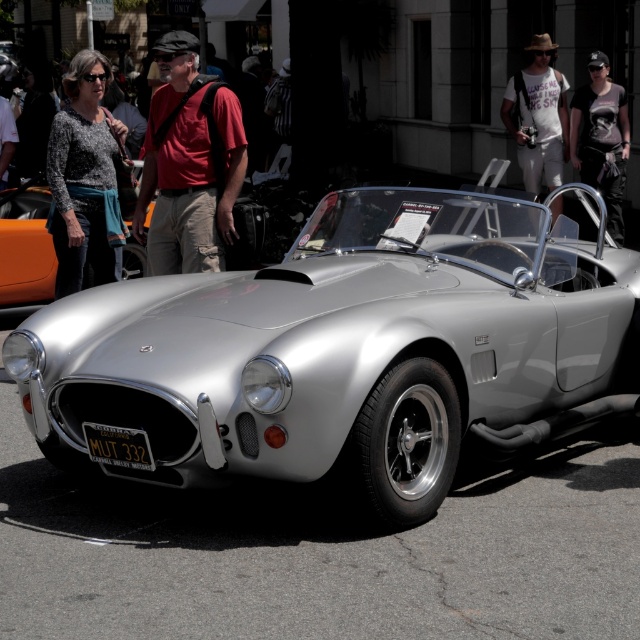
Who is lower down, dark gray cotton t-shirt at center or black metal license plate at center?

black metal license plate at center is below.

Can you confirm if dark gray cotton t-shirt at center is smaller than black metal license plate at center?

Actually, dark gray cotton t-shirt at center might be larger than black metal license plate at center.

Describe the element at coordinates (602, 138) in the screenshot. This screenshot has height=640, width=640. I see `dark gray cotton t-shirt at center` at that location.

What are the coordinates of `dark gray cotton t-shirt at center` in the screenshot? It's located at (602, 138).

How much distance is there between speckled sweater at upper left and dark gray cotton t-shirt at center?

A distance of 6.69 meters exists between speckled sweater at upper left and dark gray cotton t-shirt at center.

Between speckled sweater at upper left and dark gray cotton t-shirt at center, which one is positioned higher?

dark gray cotton t-shirt at center is above.

Does point (52, 132) come in front of point (592, 163)?

Yes.

Where is `speckled sweater at upper left`? Image resolution: width=640 pixels, height=640 pixels. speckled sweater at upper left is located at coordinates click(x=84, y=179).

Which of these two, matte red shirt at center or white cotton shirt at upper center, stands shorter?

matte red shirt at center

Does matte red shirt at center have a greater width compared to white cotton shirt at upper center?

Yes.

Does point (225, 216) come farther from viewer compared to point (541, 60)?

That is False.

The width and height of the screenshot is (640, 640). I want to click on matte red shirt at center, so click(x=188, y=163).